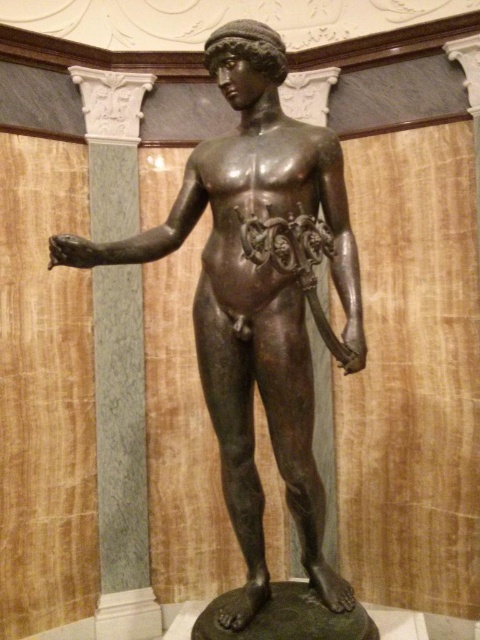
Between bronze statue at center and white marble column at left, which one has more height?

Standing taller between the two is white marble column at left.

Is bronze statue at center thinner than white marble column at left?

No, bronze statue at center is not thinner than white marble column at left.

You are a GUI agent. You are given a task and a screenshot of the screen. Output one action in this format:
    pyautogui.click(x=<x>, y=<y>)
    Task: Click on the bronze statue at center
    This screenshot has height=640, width=480.
    Given the screenshot: What is the action you would take?
    pyautogui.click(x=257, y=298)